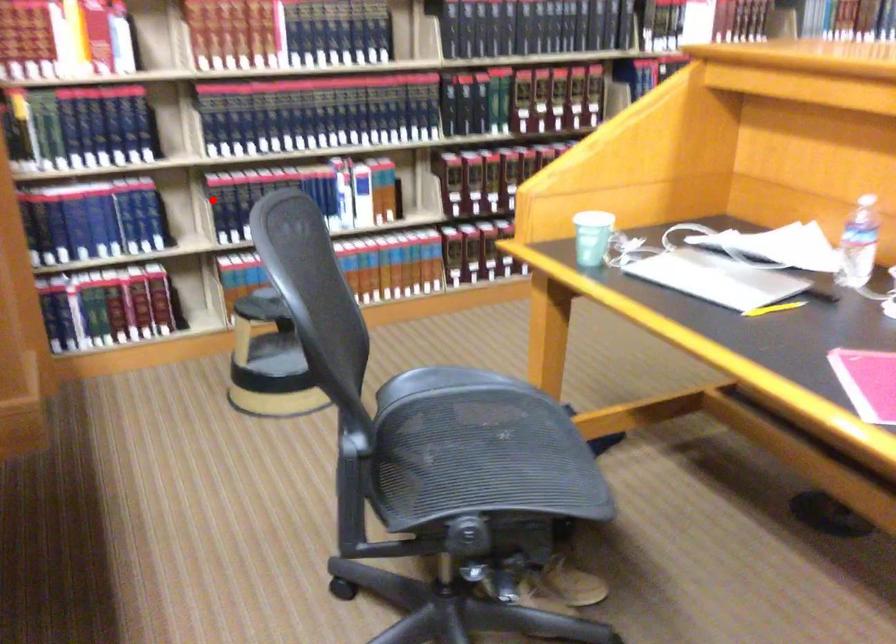
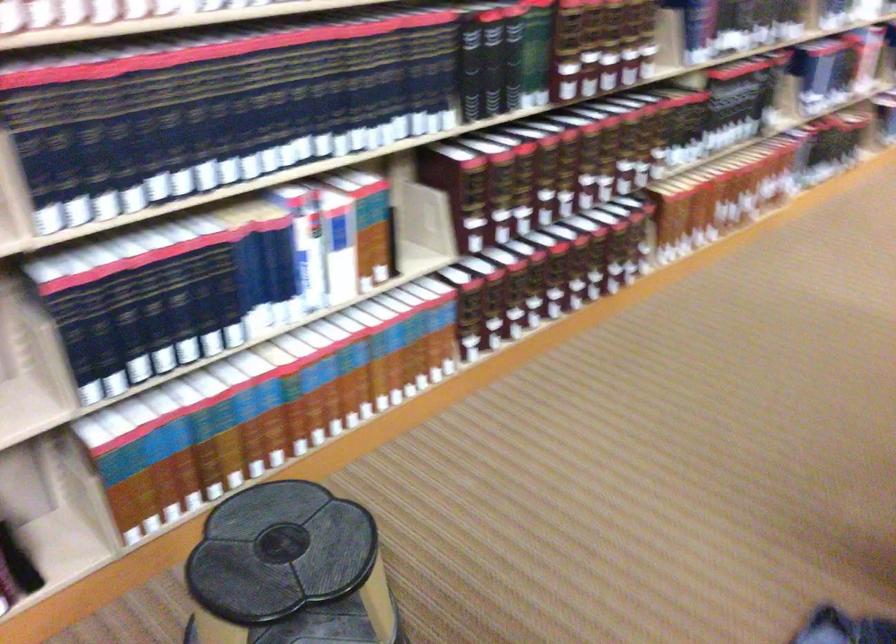
Question: I am providing you with two images of the same scene from different viewpoints. Image1 has a red point marked. In image2, the corresponding 3D location appears at what relative position? Reply with the corresponding letter.

Choices:
 (A) Closer
 (B) Farther

Answer: (A)